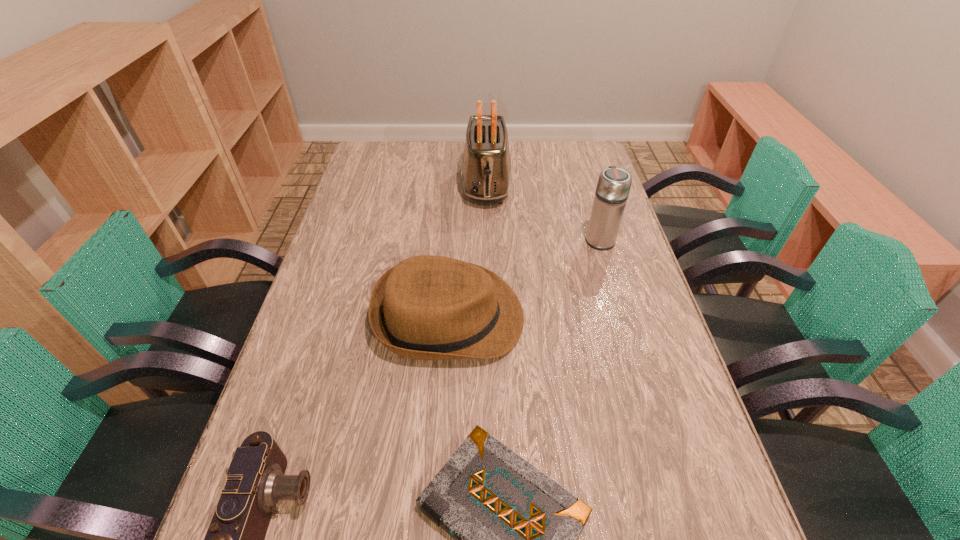
In order to click on toaster in this screenshot , I will do `click(486, 173)`.

Identify the location of the farthest object. (486, 173).

At what (x,y) coordinates should I click in order to perform the action: click on thermos bottle. Please return your answer as a coordinate pair (x, y). The image size is (960, 540). Looking at the image, I should click on (613, 187).

The width and height of the screenshot is (960, 540). In order to click on the rightmost object in this screenshot , I will do `click(613, 187)`.

Where is `fedora`? fedora is located at coordinates (427, 307).

The image size is (960, 540). In order to click on the third nearest object in this screenshot , I will do `click(427, 307)`.

You are a GUI agent. You are given a task and a screenshot of the screen. Output one action in this format:
    pyautogui.click(x=<x>, y=<y>)
    Task: Click on the vacant space located on the side of the tallest object with the control lever
    
    Given the screenshot: What is the action you would take?
    pyautogui.click(x=488, y=261)

The width and height of the screenshot is (960, 540). In order to click on vacant space located 0.220m with a handle on the side of the fourth nearest object in this screenshot , I will do `click(585, 188)`.

I want to click on free spot located 0.060m with a handle on the side of the fourth nearest object, so click(x=592, y=215).

Locate an element on the screen. Image resolution: width=960 pixels, height=540 pixels. vacant space located 0.150m with a handle on the side of the fourth nearest object is located at coordinates (588, 199).